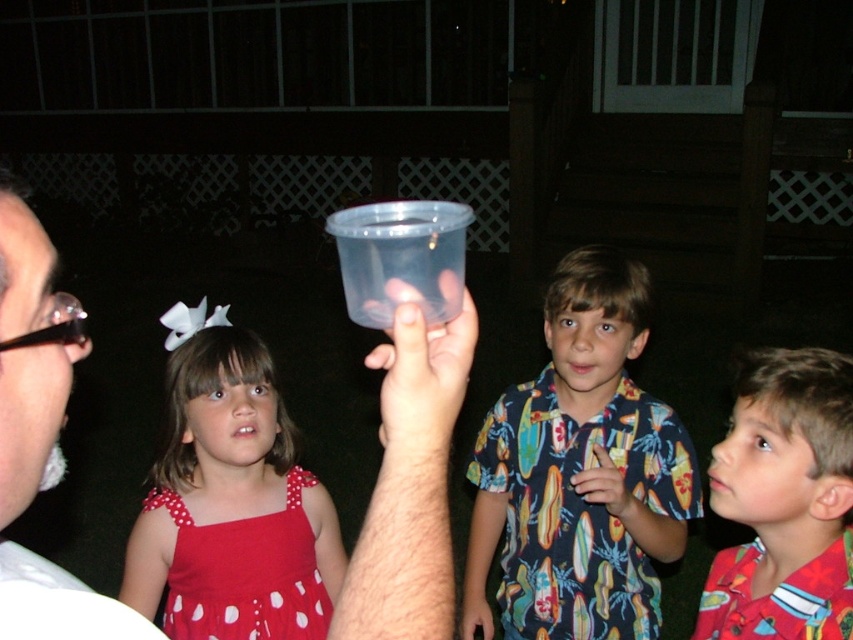
You are a photographer setting up for an evening event. You notice a matte red dress at left and a transparent plastic cup at center in the frame. Which object occupies more horizontal space in the image?

The matte red dress at left has a greater width than the transparent plastic cup at center, so the matte red dress at left occupies more horizontal space in the image.

You are standing at the point with coordinates point [45,476] and want to walk to the point with coordinates point [277,426]. Will you need to move forward or backward?

Since point [277,426] is behind point [45,476], you will need to move backward to reach it.